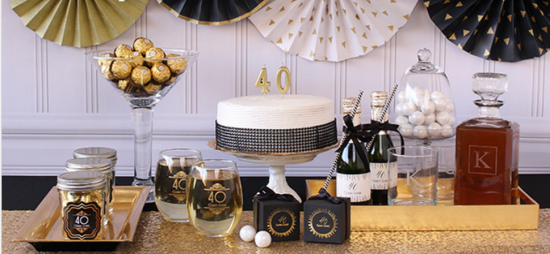
I want to click on empty glass cup, so 410,176.